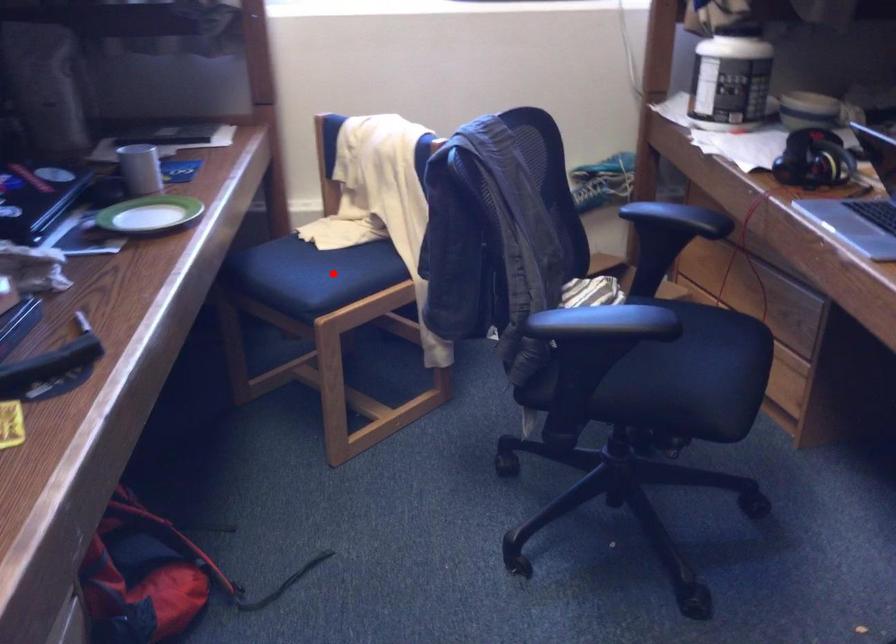
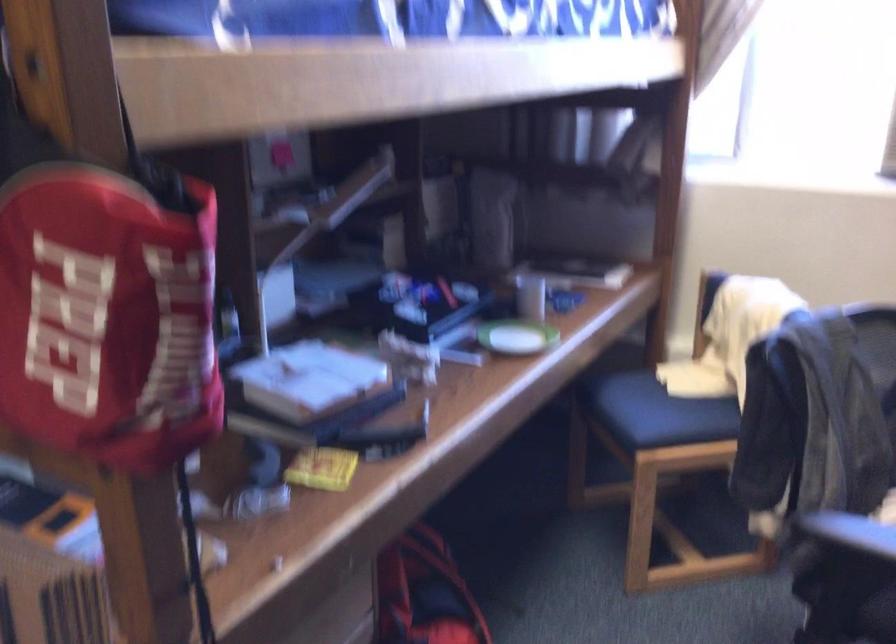
In the second image, find the point that corresponds to the highlighted location in the first image.

(668, 415)